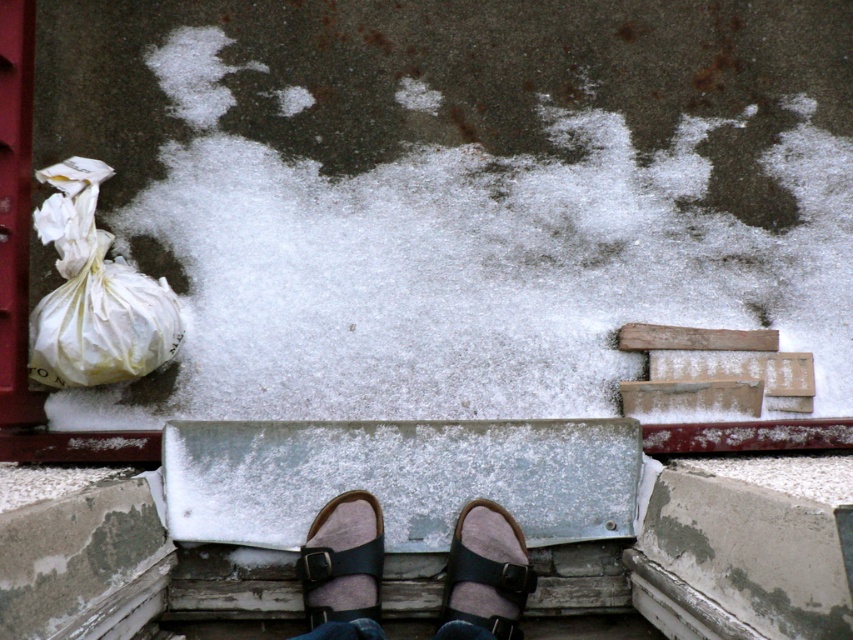
Question: Does leather sandals at center appear over leather sandal at center?

Choices:
 (A) yes
 (B) no

Answer: (B)

Question: Does white powder snow at center appear on the left side of leather sandals at center?

Choices:
 (A) no
 (B) yes

Answer: (A)

Question: Does leather sandals at center come in front of black leather sandal at center?

Choices:
 (A) no
 (B) yes

Answer: (B)

Question: Which point is farther to the camera?

Choices:
 (A) leather sandals at center
 (B) leather sandal at center
 (C) white powder snow at center

Answer: (C)

Question: Which of the following is the farthest from the observer?

Choices:
 (A) (537, 324)
 (B) (70, 202)
 (C) (520, 637)

Answer: (A)

Question: Which object is positioned closest to the white powder snow at center?

Choices:
 (A) leather sandal at center
 (B) white paper bag at left
 (C) black leather sandal at center
 (D) leather sandals at center

Answer: (B)